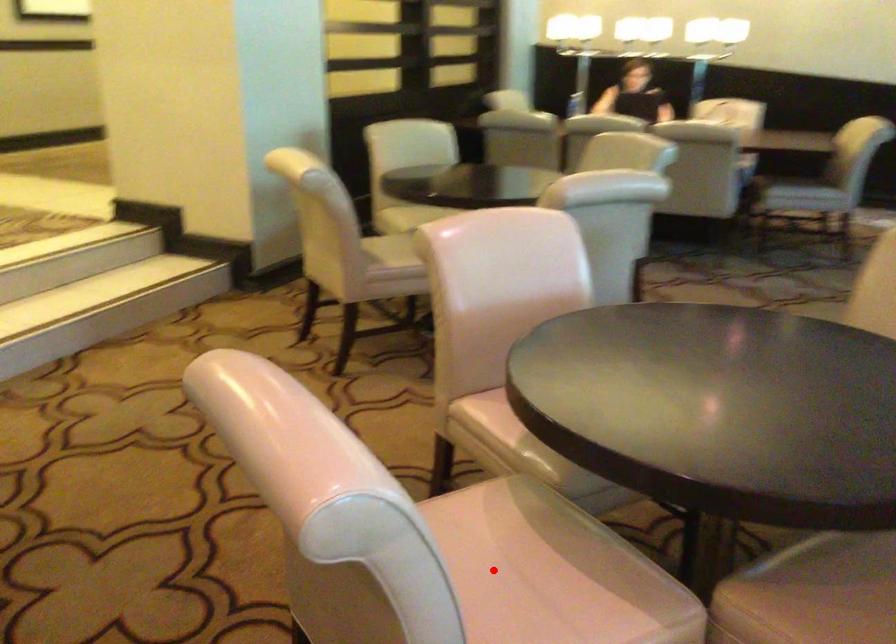
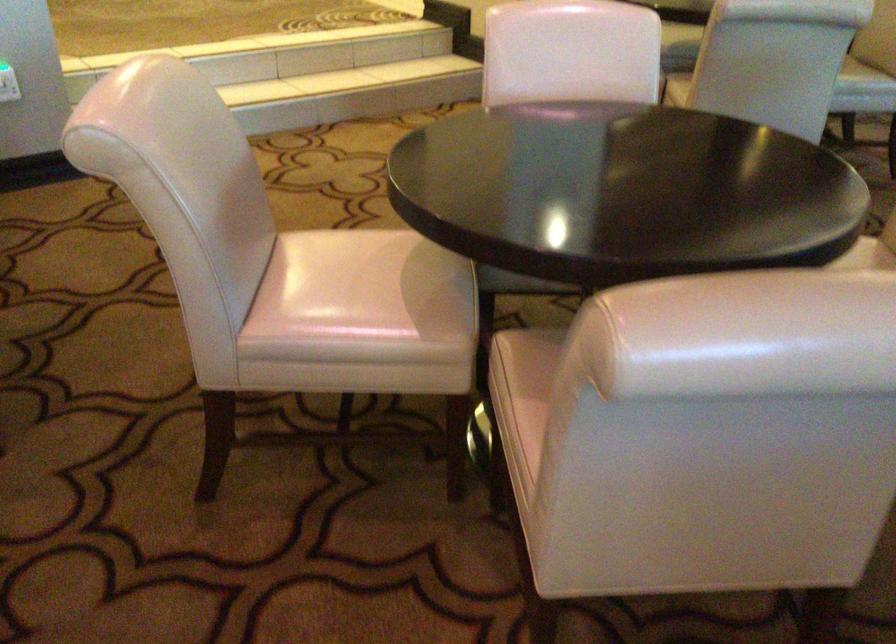
Find the pixel in the second image that matches the highlighted location in the first image.

(347, 278)